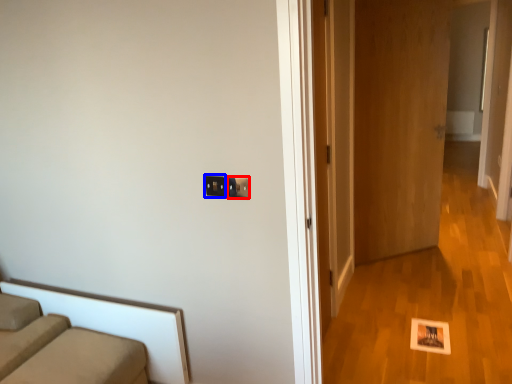
Question: Which of the following is the farthest to the observer, electric outlet (highlighted by a red box) or electric outlet (highlighted by a blue box)?

Choices:
 (A) electric outlet
 (B) electric outlet

Answer: (B)